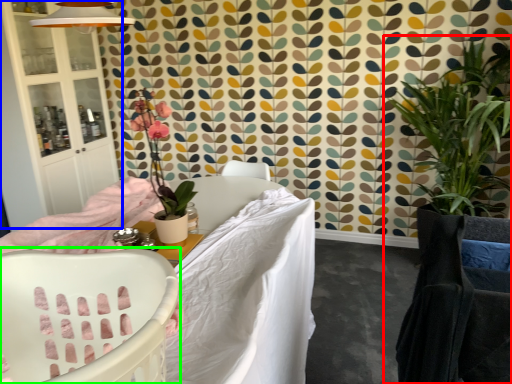
Question: Which is farther away from houseplant (highlighted by a red box)? armoire (highlighted by a blue box) or chair (highlighted by a green box)?

Choices:
 (A) armoire
 (B) chair

Answer: (A)